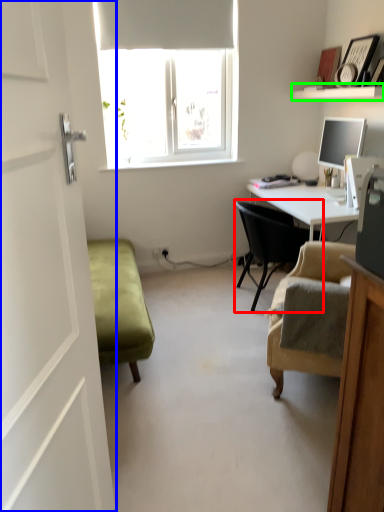
Question: Which is nearer to the chair (highlighted by a red box)? screen door (highlighted by a blue box) or shelf (highlighted by a green box).

Choices:
 (A) screen door
 (B) shelf

Answer: (B)